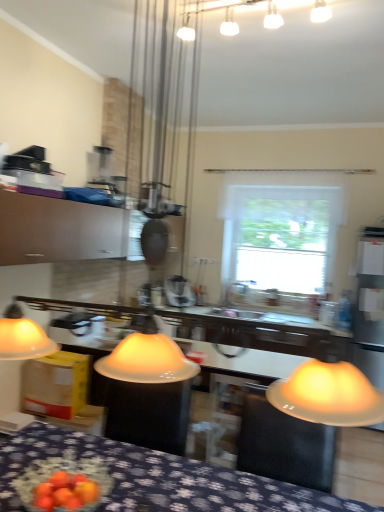
Question: Is matte white cabinet at upper left to the left of white frosted glass light fixture at upper center from the viewer's perspective?

Choices:
 (A) no
 (B) yes

Answer: (B)

Question: Is matte white cabinet at upper left positioned with its back to white frosted glass light fixture at upper center?

Choices:
 (A) no
 (B) yes

Answer: (A)

Question: Would you say matte white cabinet at upper left is a long distance from white frosted glass light fixture at upper center?

Choices:
 (A) yes
 (B) no

Answer: (A)

Question: Considering the relative sizes of matte white cabinet at upper left and white frosted glass light fixture at upper center in the image provided, is matte white cabinet at upper left wider than white frosted glass light fixture at upper center?

Choices:
 (A) yes
 (B) no

Answer: (A)

Question: From a real-world perspective, is matte white cabinet at upper left located higher than white frosted glass light fixture at upper center?

Choices:
 (A) no
 (B) yes

Answer: (A)

Question: From a real-world perspective, relative to white glossy sink at center, is matte white cabinet at upper left vertically above or below?

Choices:
 (A) above
 (B) below

Answer: (A)

Question: Choose the correct answer: Is matte white cabinet at upper left inside white glossy sink at center or outside it?

Choices:
 (A) inside
 (B) outside

Answer: (B)

Question: In terms of height, does matte white cabinet at upper left look taller or shorter compared to white glossy sink at center?

Choices:
 (A) tall
 (B) short

Answer: (A)

Question: Relative to white glossy sink at center, is matte white cabinet at upper left in front or behind?

Choices:
 (A) behind
 (B) front

Answer: (B)

Question: Visually, is white frosted glass light fixture at upper center positioned to the left or to the right of white matte window at center?

Choices:
 (A) left
 (B) right

Answer: (A)

Question: From their relative heights in the image, would you say white frosted glass light fixture at upper center is taller or shorter than white matte window at center?

Choices:
 (A) short
 (B) tall

Answer: (A)

Question: From a real-world perspective, is white frosted glass light fixture at upper center physically located above or below white matte window at center?

Choices:
 (A) below
 (B) above

Answer: (B)

Question: From the image's perspective, relative to white matte window at center, is white frosted glass light fixture at upper center above or below?

Choices:
 (A) above
 (B) below

Answer: (A)

Question: From the image's perspective, relative to white glossy sink at center, is white matte window at center above or below?

Choices:
 (A) below
 (B) above

Answer: (B)

Question: Considering the positions of white matte window at center and white glossy sink at center in the image, is white matte window at center taller or shorter than white glossy sink at center?

Choices:
 (A) short
 (B) tall

Answer: (B)